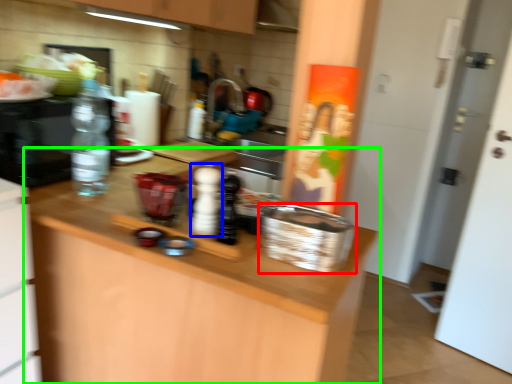
Question: Estimate the real-world distances between objects in this image. Which object is farther from basket (highlighted by a red box), bottle (highlighted by a blue box) or countertop (highlighted by a green box)?

Choices:
 (A) bottle
 (B) countertop

Answer: (B)